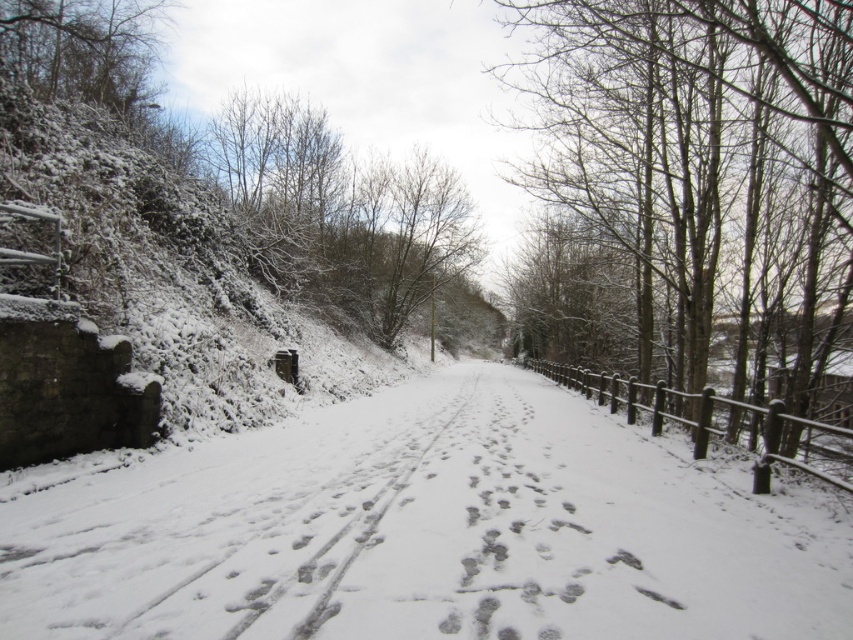
Question: Which point is closer to the camera?

Choices:
 (A) white powdery snow at center
 (B) snow-covered wooden fence at right

Answer: (A)

Question: In this image, where is white powdery snow at center located relative to snow-covered wooden fence at right?

Choices:
 (A) above
 (B) below

Answer: (B)

Question: Which object appears farthest from the camera in this image?

Choices:
 (A) snow-covered wooden fence at right
 (B) white powdery snow at center

Answer: (A)

Question: Is white powdery snow at center above snow-covered wooden fence at right?

Choices:
 (A) no
 (B) yes

Answer: (A)

Question: Considering the relative positions of white powdery snow at center and snow-covered wooden fence at right in the image provided, where is white powdery snow at center located with respect to snow-covered wooden fence at right?

Choices:
 (A) left
 (B) right

Answer: (A)